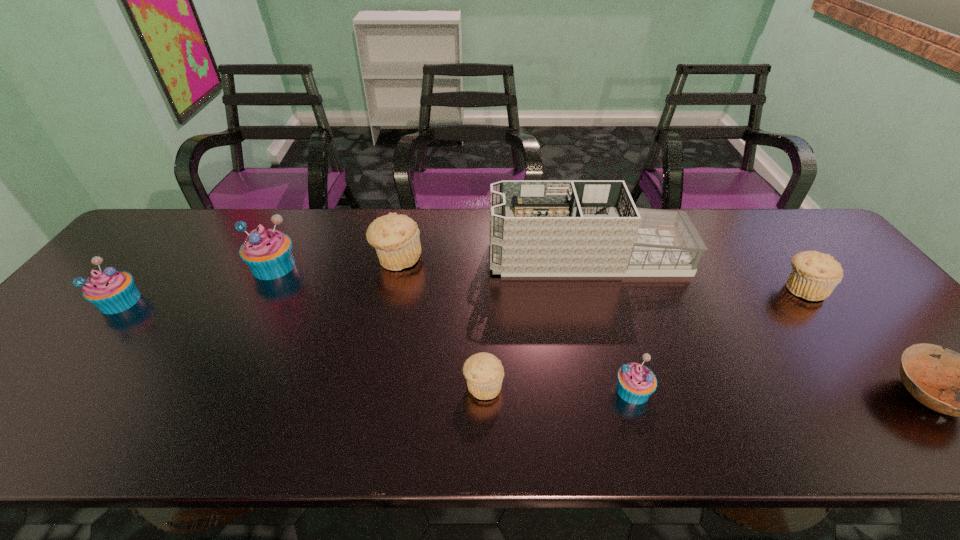
Locate an element on the screen. unoccupied position between the farthest blue muffin and the leftmost blue muffin is located at coordinates (197, 284).

Where is `free space between the leftmost object and the second beige muffin from left to right`? free space between the leftmost object and the second beige muffin from left to right is located at coordinates (301, 343).

Image resolution: width=960 pixels, height=540 pixels. Identify the location of vacant area that lies between the biggest beige muffin and the fourth muffin from left to right. (441, 322).

At what (x,y) coordinates should I click in order to perform the action: click on empty space between the rightmost muffin and the rightmost blue muffin. Please return your answer as a coordinate pair (x, y). This screenshot has width=960, height=540. Looking at the image, I should click on (718, 340).

Identify the location of empty location between the fifth muffin from right to left and the tallest object. (430, 261).

Identify the location of vacant point located between the second smallest beige muffin and the second beige muffin from left to right. (643, 337).

At what (x,y) coordinates should I click in order to perform the action: click on free space between the leftmost muffin and the biggest beige muffin. Please return your answer as a coordinate pair (x, y). This screenshot has width=960, height=540. Looking at the image, I should click on (258, 280).

This screenshot has width=960, height=540. I want to click on the fourth closest object to the second biggest blue muffin, so click(538, 228).

You are a GUI agent. You are given a task and a screenshot of the screen. Output one action in this format:
    pyautogui.click(x=<x>, y=<y>)
    Task: Click on the object identified as the second closest to the rightmost beige muffin
    Image resolution: width=960 pixels, height=540 pixels.
    Given the screenshot: What is the action you would take?
    pyautogui.click(x=538, y=228)

Identify the location of the second closest muffin relative to the fourth muffin from left to right. (396, 238).